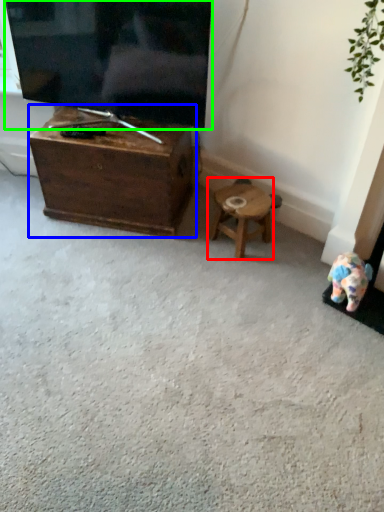
Question: Based on their relative distances, which object is farther from stool (highlighted by a red box)? Choose from table (highlighted by a blue box) and television (highlighted by a green box).

Choices:
 (A) table
 (B) television

Answer: (B)